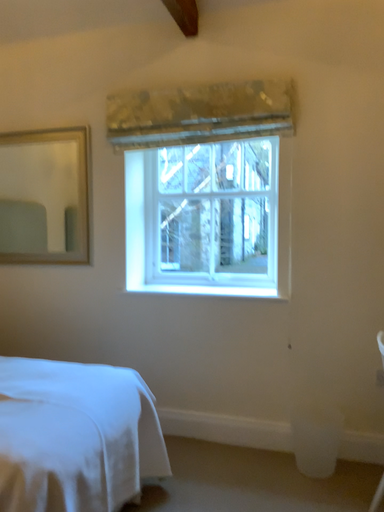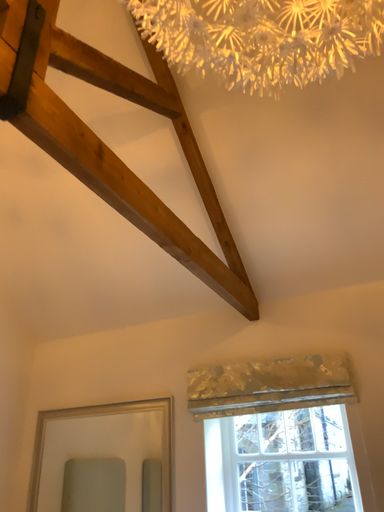
Question: Which way did the camera rotate in the video?

Choices:
 (A) rotated downward
 (B) rotated upward

Answer: (B)